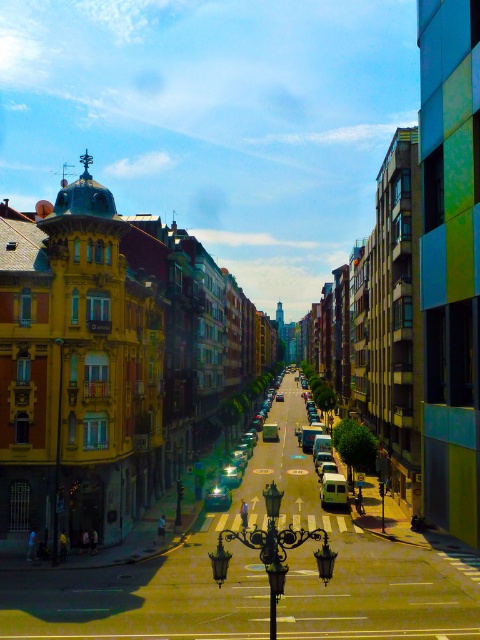
You are a pedestrian standing at the top of the avenue looking down. You need to cross the street to reach the modern building on the right. Which vehicle, the shiny silver car at center or the white matte van at center, should you wait behind to ensure you are closer to the curb when crossing?

You should wait behind the shiny silver car at center because it is closer to you than the white matte van at center, so positioning yourself there would place you nearer to the curb when crossing.

In the scene shown: You are a delivery driver who needs to park your vehicle in a tight spot between two buildings. You have a shiny silver car at center and a white matte van at center. Which vehicle would be easier to maneuver into the space?

The shiny silver car at center occupies less space than the white matte van at center, so it would be easier to maneuver the shiny silver car at center into the tight parking spot.